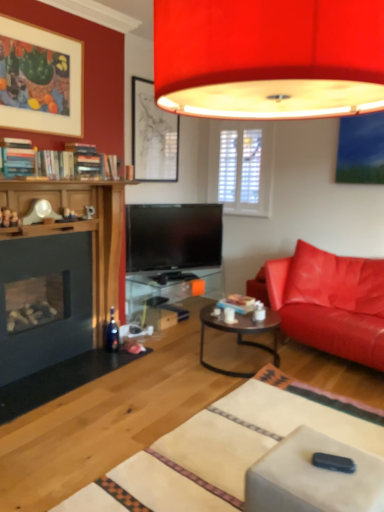
Question: Is matte black picture frame at upper center, marked as the first picture frame in a back-to-front arrangement, positioned with its back to matte black coffee table at center?

Choices:
 (A) no
 (B) yes

Answer: (A)

Question: Is matte black picture frame at upper center, the second picture frame positioned from the left, oriented towards matte black coffee table at center?

Choices:
 (A) yes
 (B) no

Answer: (B)

Question: From a real-world perspective, is matte black picture frame at upper center, marked as the first picture frame in a back-to-front arrangement, below matte black coffee table at center?

Choices:
 (A) no
 (B) yes

Answer: (A)

Question: Does matte black picture frame at upper center, the 2th picture frame when ordered from front to back, have a greater width compared to matte black coffee table at center?

Choices:
 (A) yes
 (B) no

Answer: (B)

Question: Can we say matte black picture frame at upper center, the second picture frame positioned from the left, lies outside matte black coffee table at center?

Choices:
 (A) yes
 (B) no

Answer: (A)

Question: Is matte black picture frame at upper center, the 2th picture frame when ordered from front to back, with matte black coffee table at center?

Choices:
 (A) no
 (B) yes

Answer: (A)

Question: Is matte white picture frame at upper left, placed as the 1th picture frame when sorted from left to right, bigger than transparent glass table at center?

Choices:
 (A) yes
 (B) no

Answer: (B)

Question: Does matte white picture frame at upper left, placed as the 1th picture frame when sorted from left to right, contain transparent glass table at center?

Choices:
 (A) no
 (B) yes

Answer: (A)

Question: From a real-world perspective, is matte white picture frame at upper left, placed as the second picture frame when sorted from right to left, physically below transparent glass table at center?

Choices:
 (A) yes
 (B) no

Answer: (B)

Question: Is matte white picture frame at upper left, placed as the 1th picture frame when sorted from left to right, completely or partially outside of transparent glass table at center?

Choices:
 (A) no
 (B) yes

Answer: (B)

Question: Is the position of matte white picture frame at upper left, the 2th picture frame in the back-to-front sequence, less distant than that of transparent glass table at center?

Choices:
 (A) no
 (B) yes

Answer: (B)

Question: Considering the relative positions of matte white picture frame at upper left, the 1th picture frame when ordered from front to back, and transparent glass table at center in the image provided, is matte white picture frame at upper left, the 1th picture frame when ordered from front to back, to the left of transparent glass table at center from the viewer's perspective?

Choices:
 (A) yes
 (B) no

Answer: (A)

Question: From a real-world perspective, is matte black picture frame at upper center, the second picture frame positioned from the left, located beneath matte white picture frame at upper left, placed as the 1th picture frame when sorted from left to right?

Choices:
 (A) no
 (B) yes

Answer: (B)